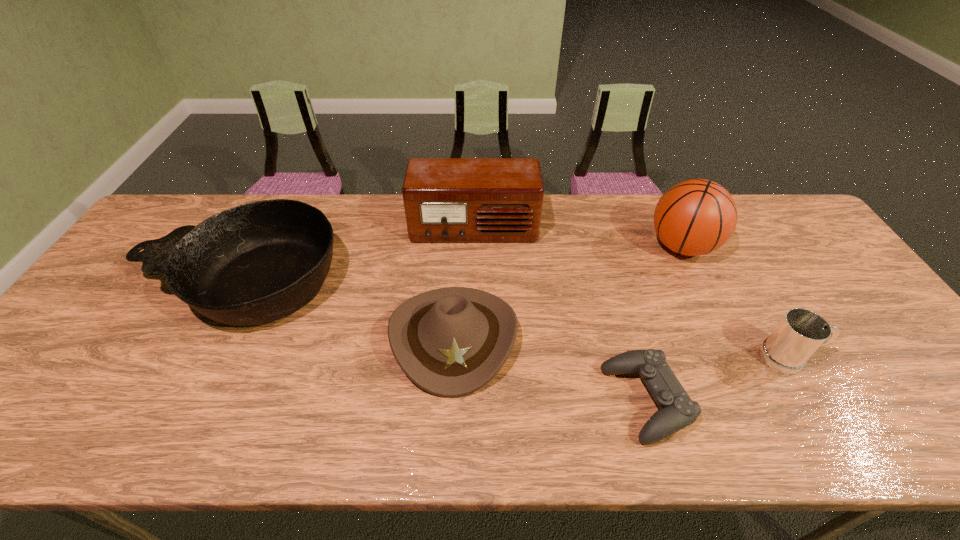
Where is `vacant space located on the side of the mug with the handle`? vacant space located on the side of the mug with the handle is located at coordinates (863, 358).

This screenshot has height=540, width=960. In order to click on free point located 0.060m with a star on the front of the cowboy hat in this screenshot , I will do `click(449, 423)`.

Identify the location of free space located 0.340m on the right of the shortest object. (838, 401).

You are a GUI agent. You are given a task and a screenshot of the screen. Output one action in this format:
    pyautogui.click(x=<x>, y=<y>)
    Task: Click on the basketball that is positioned at the far edge
    This screenshot has height=540, width=960.
    Given the screenshot: What is the action you would take?
    pyautogui.click(x=695, y=217)

You are a GUI agent. You are given a task and a screenshot of the screen. Output one action in this format:
    pyautogui.click(x=<x>, y=<y>)
    Task: Click on the radio receiver at the far edge
    The image size is (960, 540).
    Given the screenshot: What is the action you would take?
    pyautogui.click(x=446, y=200)

At what (x,y) coordinates should I click in order to perform the action: click on frying pan that is at the far edge. Please return your answer as a coordinate pair (x, y). This screenshot has height=540, width=960. Looking at the image, I should click on (256, 263).

The height and width of the screenshot is (540, 960). I want to click on object situated at the near edge, so click(x=677, y=411).

At what (x,y) coordinates should I click in order to perform the action: click on object located at the left edge. Please return your answer as a coordinate pair (x, y). Image resolution: width=960 pixels, height=540 pixels. Looking at the image, I should click on (256, 263).

Where is `object that is at the far left corner`? The width and height of the screenshot is (960, 540). object that is at the far left corner is located at coordinates (256, 263).

At what (x,y) coordinates should I click in order to perform the action: click on vacant space at the far edge of the desktop. Please return your answer as a coordinate pair (x, y). The image size is (960, 540). Looking at the image, I should click on (643, 199).